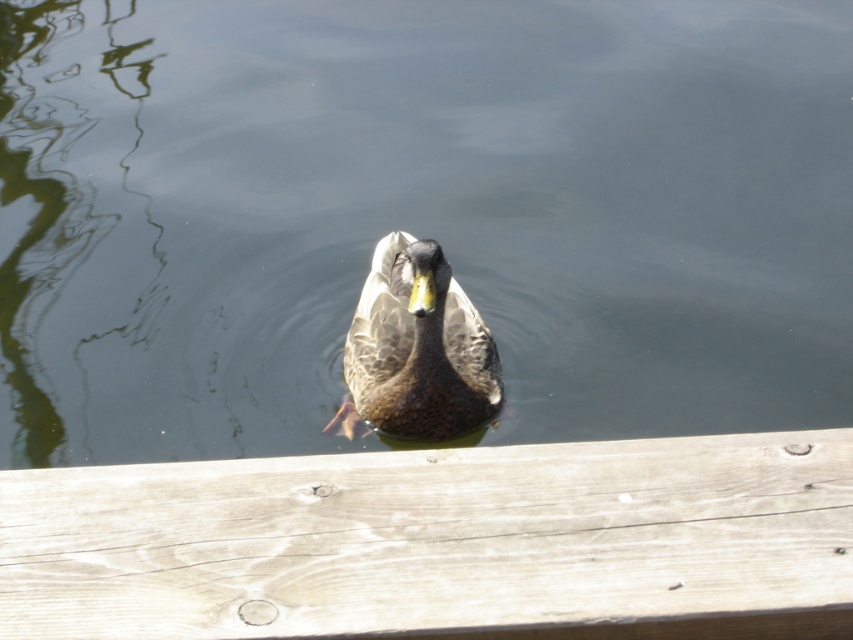
Question: Which object is the closest to the brown speckled duck at center?

Choices:
 (A) light brown wood at center
 (B) greenish water at center

Answer: (B)

Question: Is greenish water at center below brown speckled duck at center?

Choices:
 (A) no
 (B) yes

Answer: (A)

Question: Considering the relative positions of greenish water at center and brown speckled duck at center in the image provided, where is greenish water at center located with respect to brown speckled duck at center?

Choices:
 (A) left
 (B) right

Answer: (A)

Question: Where is greenish water at center located in relation to light brown wood at center in the image?

Choices:
 (A) right
 (B) left

Answer: (B)

Question: Based on their relative distances, which object is nearer to the light brown wood at center?

Choices:
 (A) greenish water at center
 (B) brown speckled duck at center

Answer: (B)

Question: Which point is farther from the camera taking this photo?

Choices:
 (A) (392, 289)
 (B) (654, 532)
 (C) (683, 116)

Answer: (C)